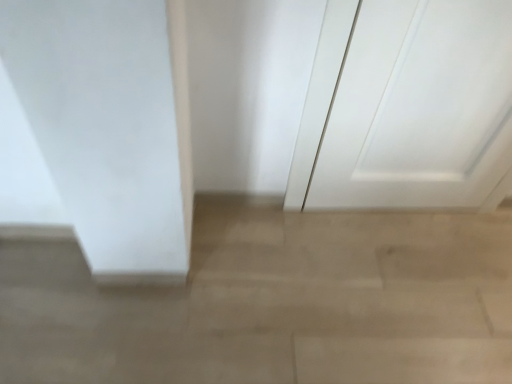
This screenshot has height=384, width=512. What are the coordinates of `vacant area situated below white matte door at upper right (from a real-world perspective)` in the screenshot? It's located at (397, 214).